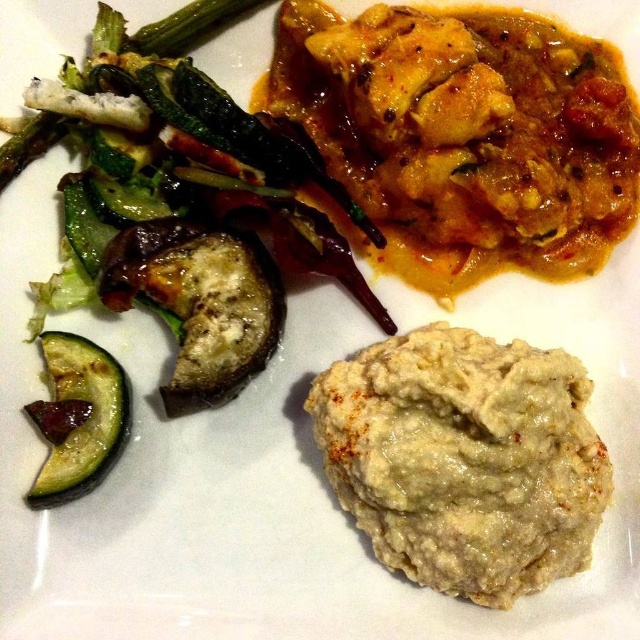
Question: Can you confirm if white creamy paste at center is positioned above green matte cucumber at lower left?

Choices:
 (A) yes
 (B) no

Answer: (B)

Question: Which point is closer to the camera taking this photo?

Choices:
 (A) (529, 458)
 (B) (54, 458)

Answer: (A)

Question: Where is white creamy paste at center located in relation to green matte cucumber at lower left in the image?

Choices:
 (A) left
 (B) right

Answer: (B)

Question: Can you confirm if white creamy paste at center is positioned above green matte cucumber at lower left?

Choices:
 (A) no
 (B) yes

Answer: (A)

Question: Among these points, which one is farthest from the camera?

Choices:
 (A) (100, 396)
 (B) (515, 524)

Answer: (A)